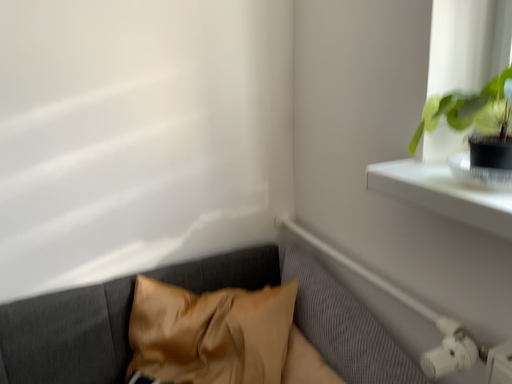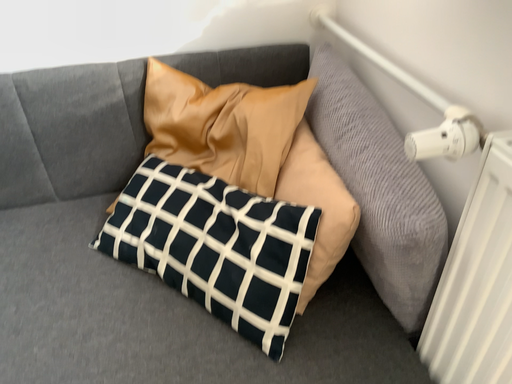
Question: Which way did the camera rotate in the video?

Choices:
 (A) rotated left
 (B) rotated right

Answer: (A)